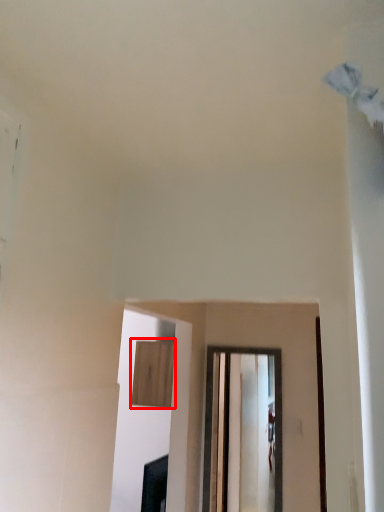
Question: From the image's perspective, considering the relative positions of cabinetry (annotated by the red box) and window in the image provided, where is cabinetry (annotated by the red box) located with respect to the staircase?

Choices:
 (A) above
 (B) below

Answer: (A)